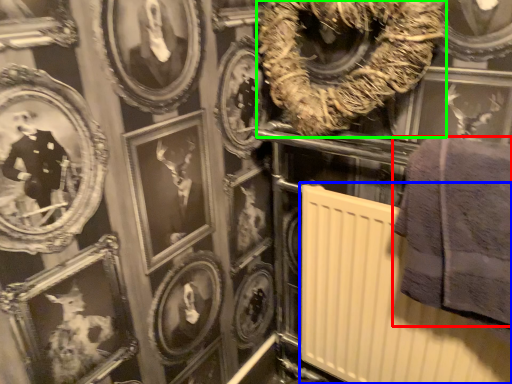
Question: Based on their relative distances, which object is nearer to towel (highlighted by a red box)? Choose from radiator (highlighted by a blue box) and decor (highlighted by a green box).

Choices:
 (A) radiator
 (B) decor

Answer: (A)